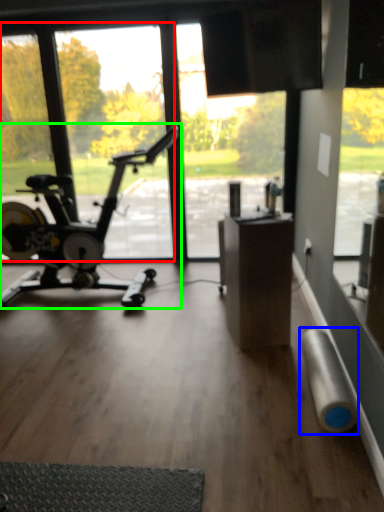
Question: Based on their relative distances, which object is farther from window screen (highlighted by a red box)? Choose from duct tape (highlighted by a blue box) and stationary bicycle (highlighted by a green box).

Choices:
 (A) duct tape
 (B) stationary bicycle

Answer: (A)